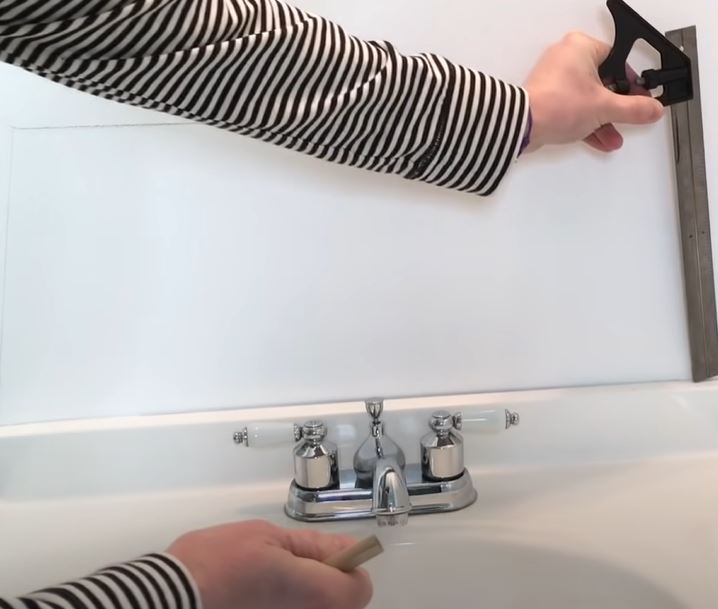
Find the location of a particular element. The image size is (718, 609). faucet is located at coordinates (385, 490).